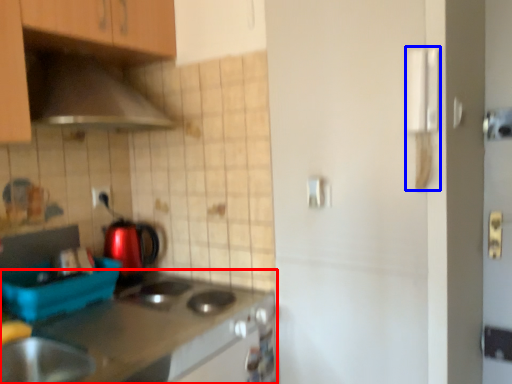
Question: Which of the following is the farthest to the observer, countertop (highlighted by a red box) or door handle (highlighted by a blue box)?

Choices:
 (A) countertop
 (B) door handle

Answer: (B)